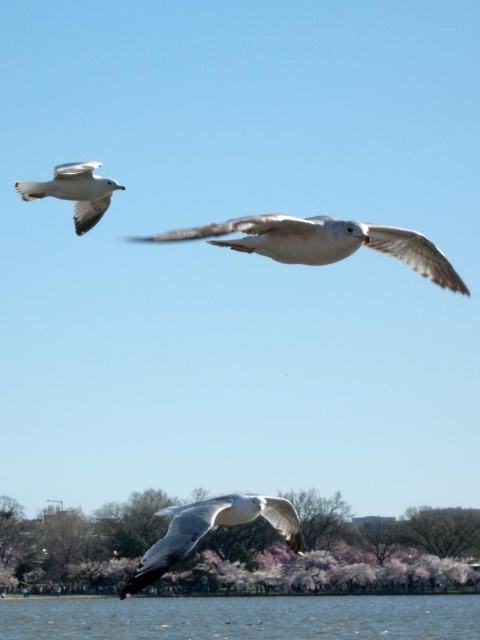
Is white feathered bird at lower center below white feathered bird at left?

Correct, white feathered bird at lower center is located below white feathered bird at left.

The image size is (480, 640). In order to click on white feathered bird at lower center in this screenshot , I will do `click(211, 529)`.

In the scene shown: Can you confirm if white feathered bird at center is bigger than white feathered bird at lower center?

Indeed, white feathered bird at center has a larger size compared to white feathered bird at lower center.

What do you see at coordinates (321, 243) in the screenshot? This screenshot has height=640, width=480. I see `white feathered bird at center` at bounding box center [321, 243].

Between point (241, 218) and point (186, 548), which one is positioned in front?

Positioned in front is point (241, 218).

At what (x,y) coordinates should I click in order to perform the action: click on white feathered bird at center. Please return your answer as a coordinate pair (x, y). Image resolution: width=480 pixels, height=640 pixels. Looking at the image, I should click on (321, 243).

How distant is clear water at lower center from white feathered bird at left?

They are 65.50 meters apart.

Is clear water at lower center wider than white feathered bird at left?

Indeed, clear water at lower center has a greater width compared to white feathered bird at left.

Is point (230, 636) farther from viewer compared to point (86, 220)?

Yes, point (230, 636) is behind point (86, 220).

I want to click on clear water at lower center, so click(x=241, y=618).